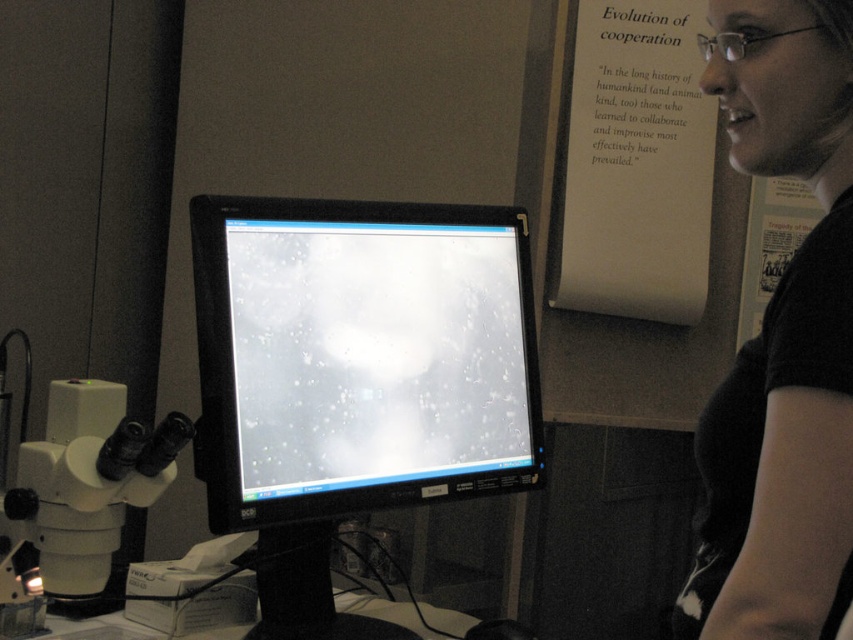
Can you confirm if white paper at upper right is positioned below white plastic microscope at lower left?

Actually, white paper at upper right is above white plastic microscope at lower left.

Is point (621, 204) closer to viewer compared to point (22, 467)?

No, it is behind (22, 467).

Which is behind, point (596, 125) or point (103, 452)?

Point (596, 125)

Identify the location of white paper at upper right. This screenshot has height=640, width=853. (633, 164).

Between black glossy monitor at center and white plastic microscope at lower left, which one is positioned higher?

black glossy monitor at center

Is black glossy monitor at center to the right of white plastic microscope at lower left from the viewer's perspective?

Correct, you'll find black glossy monitor at center to the right of white plastic microscope at lower left.

You are a GUI agent. You are given a task and a screenshot of the screen. Output one action in this format:
    pyautogui.click(x=<x>, y=<y>)
    Task: Click on the black glossy monitor at center
    The image size is (853, 640).
    Given the screenshot: What is the action you would take?
    pyautogui.click(x=355, y=376)

The width and height of the screenshot is (853, 640). In order to click on black glossy monitor at center in this screenshot , I will do `click(355, 376)`.

Is black glossy monitor at center wider than white paper at upper right?

Yes, black glossy monitor at center is wider than white paper at upper right.

Can you confirm if black glossy monitor at center is positioned to the left of white paper at upper right?

Indeed, black glossy monitor at center is positioned on the left side of white paper at upper right.

Identify the location of black glossy monitor at center. The image size is (853, 640). (355, 376).

Where is `black glossy monitor at center`? The width and height of the screenshot is (853, 640). black glossy monitor at center is located at coordinates (355, 376).